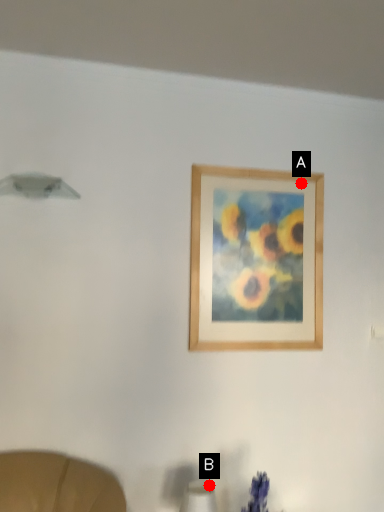
Question: Two points are circled on the image, labeled by A and B beside each circle. Which point is farther from the camera taking this photo?

Choices:
 (A) A is further
 (B) B is further

Answer: (A)